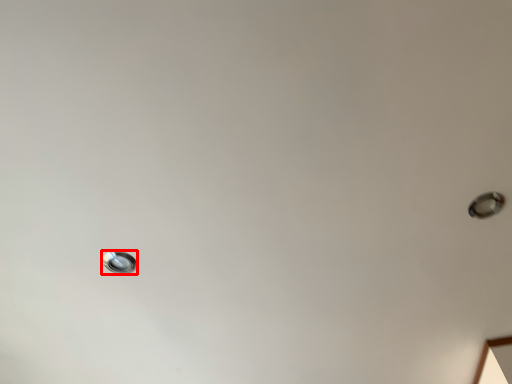
Question: In this image, where is droplight (annotated by the red box) located relative to droplight?

Choices:
 (A) left
 (B) right

Answer: (A)